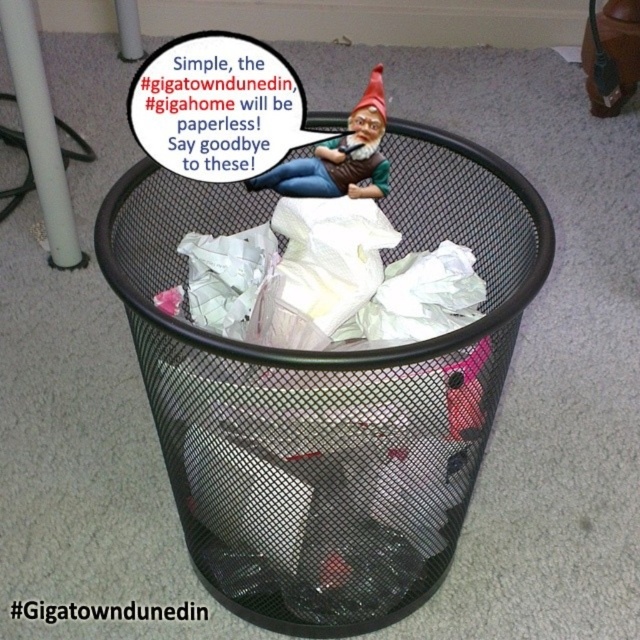
You are an interior designer assessing the placement of the matte plastic gnome at upper center and the red felt gnome hat at upper center. Which object would you need to adjust if you want to ensure the shorter one is placed on top of the taller one?

The red felt gnome hat at upper center is shorter than the matte plastic gnome at upper center. To place the shorter one on top of the taller one, you would need to adjust the red felt gnome hat at upper center to be on top of the matte plastic gnome at upper center.